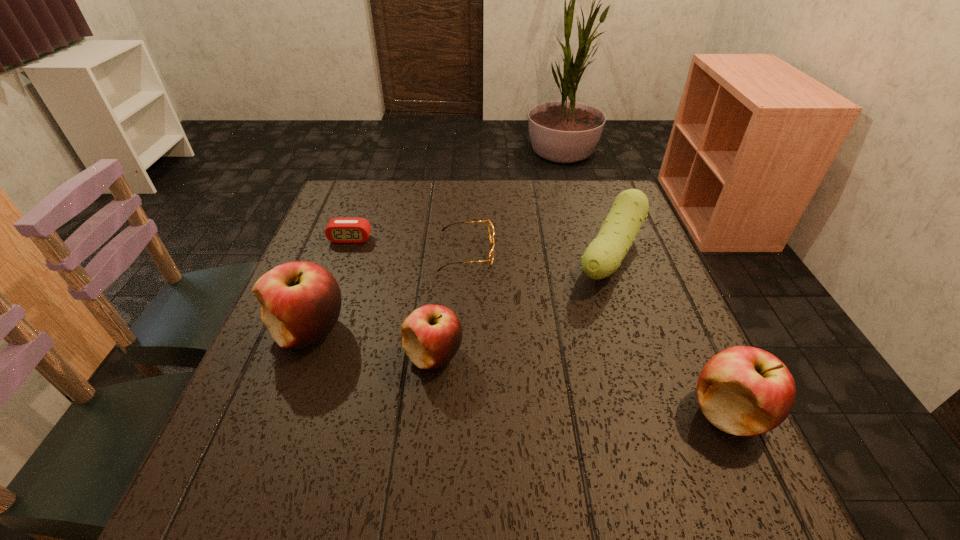
Locate an element on the screen. The width and height of the screenshot is (960, 540). vacant space situated on the front-facing side of the spectacles is located at coordinates point(641,252).

I want to click on free region located 0.060m on the front of the cucumber, so click(x=632, y=316).

The height and width of the screenshot is (540, 960). I want to click on free space located 0.110m on the front-facing side of the alarm clock, so click(339, 271).

Where is `object that is at the far edge`? object that is at the far edge is located at coordinates (603, 256).

This screenshot has width=960, height=540. Find the location of `object located at the near edge`. object located at the near edge is located at coordinates (744, 391).

Where is `apple that is at the left edge`? This screenshot has width=960, height=540. apple that is at the left edge is located at coordinates (300, 301).

Identify the location of alarm clock located in the left edge section of the desktop. (339, 230).

Identify the location of apple located in the right edge section of the desktop. tap(744, 391).

You are a GUI agent. You are given a task and a screenshot of the screen. Output one action in this format:
    pyautogui.click(x=<x>, y=<y>)
    Task: Click on the cucumber positioned at the right edge
    The height and width of the screenshot is (540, 960).
    Given the screenshot: What is the action you would take?
    pyautogui.click(x=603, y=256)

You are a GUI agent. You are given a task and a screenshot of the screen. Output one action in this format:
    pyautogui.click(x=<x>, y=<y>)
    Task: Click on the object that is at the far right corner
    
    Given the screenshot: What is the action you would take?
    pyautogui.click(x=603, y=256)